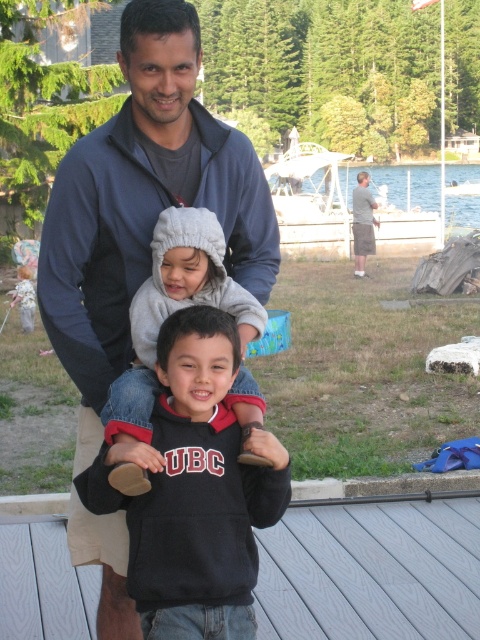
Question: Which of the following is the closest to the observer?

Choices:
 (A) dark blue fleece jacket at center
 (B) black fleece sweatshirt at center
 (C) gray wood deck at center
 (D) gray fleece hoodie at center

Answer: (D)

Question: Is gray fleece hoodie at center thinner than gray cotton shorts at right?

Choices:
 (A) no
 (B) yes

Answer: (B)

Question: From the image, what is the correct spatial relationship of dark blue fleece jacket at center in relation to gray cotton shorts at right?

Choices:
 (A) above
 (B) below

Answer: (B)

Question: Which point is farther to the camera?

Choices:
 (A) (35, 566)
 (B) (241, 588)
 (C) (154, 45)

Answer: (A)

Question: Is dark blue fleece jacket at center to the left of gray wood deck at center from the viewer's perspective?

Choices:
 (A) no
 (B) yes

Answer: (B)

Question: Which of these objects is positioned closest to the black fleece sweatshirt at center?

Choices:
 (A) gray fleece hoodie at center
 (B) gray wood deck at center

Answer: (A)